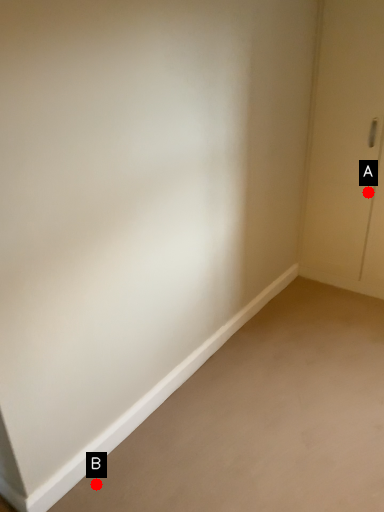
Question: Two points are circled on the image, labeled by A and B beside each circle. Which point is further to the camera?

Choices:
 (A) A is further
 (B) B is further

Answer: (A)